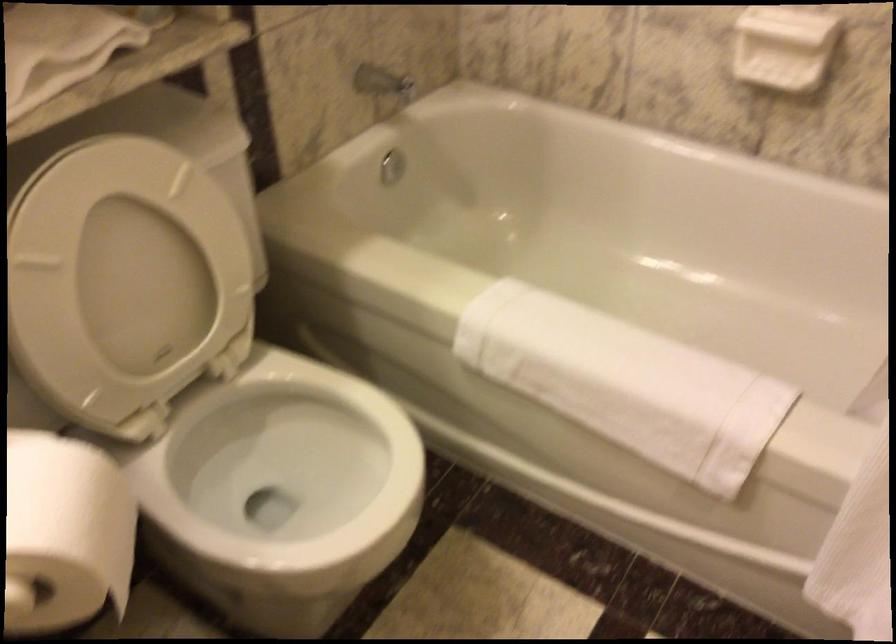
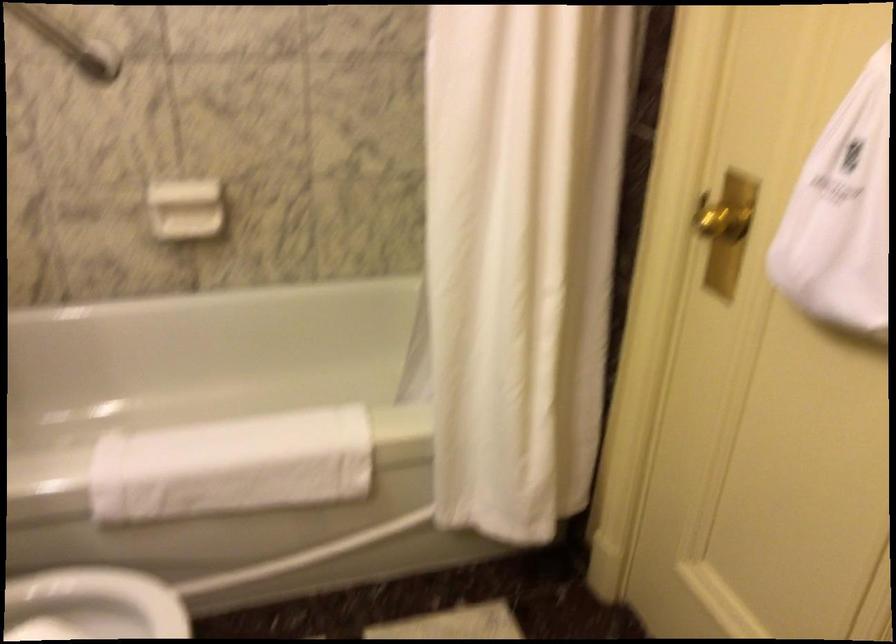
In the second image, find the point that corresponds to pixel 596 372 in the first image.

(231, 466)